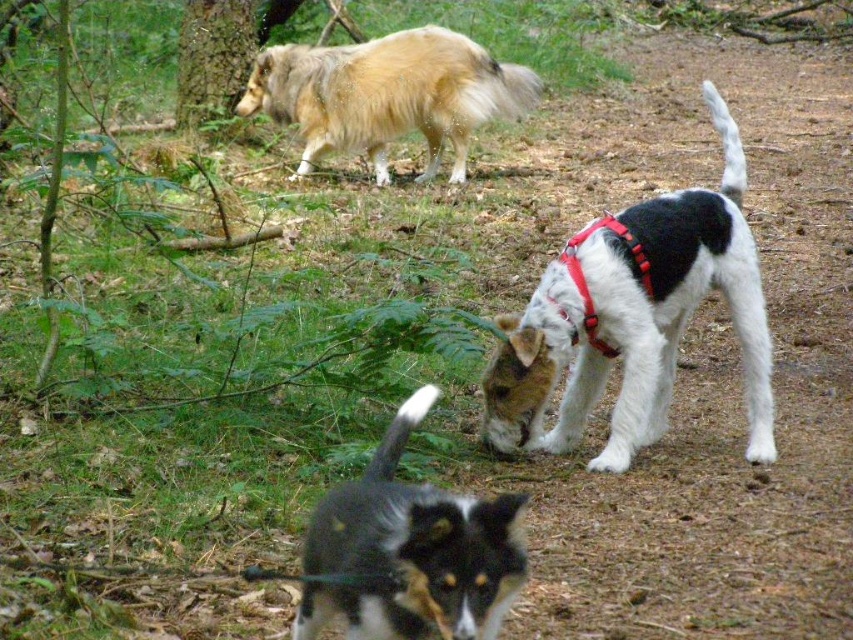
Question: Does black and white fur at lower center have a larger size compared to golden fur dog at upper left?

Choices:
 (A) no
 (B) yes

Answer: (A)

Question: Which point is farther from the camera taking this photo?

Choices:
 (A) (300, 592)
 (B) (614, 465)

Answer: (B)

Question: Which object is positioned farthest from the black and white fur at lower center?

Choices:
 (A) white fur with black spots at center
 (B) golden fur dog at upper left

Answer: (B)

Question: Does black and white fur at lower center have a lesser width compared to golden fur dog at upper left?

Choices:
 (A) no
 (B) yes

Answer: (B)

Question: Is black and white fur at lower center in front of golden fur dog at upper left?

Choices:
 (A) no
 (B) yes

Answer: (B)

Question: Based on their relative distances, which object is nearer to the white fur with black spots at center?

Choices:
 (A) golden fur dog at upper left
 (B) black and white fur at lower center

Answer: (B)